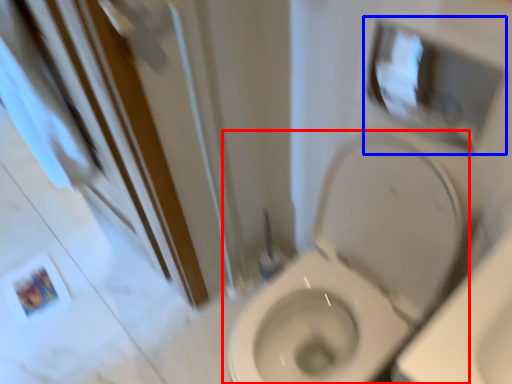
Question: Which object is further to the camera taking this photo, toilet (highlighted by a red box) or medicine cabinet (highlighted by a blue box)?

Choices:
 (A) toilet
 (B) medicine cabinet

Answer: (B)